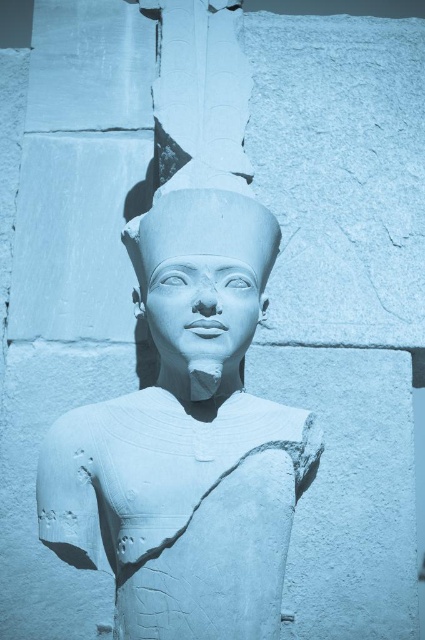
You are an archaeologist examining the image of an ancient Egyptian statue. You notice two objects labeled as the white stone statue at center and the white stone head at center. Based on their positions, which one is located to the right?

The white stone statue at center is to the right of the white stone head at center, so the white stone statue at center is located to the right.

You are an archaeologist examining the white stone statue at center and the white stone head at center. Which object has a greater width?

The white stone statue at center is wider than the white stone head at center according to the description.

You are an archaeologist examining the white stone statue at center. What are the coordinates of the statue?

The white stone statue at center is located at point (187, 440).